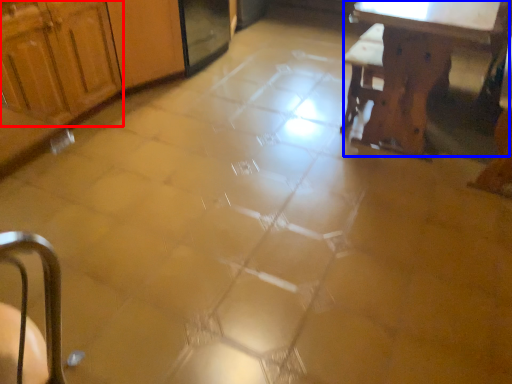
Question: Among these objects, which one is nearest to the camera, cabinetry (highlighted by a red box) or table (highlighted by a blue box)?

Choices:
 (A) cabinetry
 (B) table

Answer: (B)